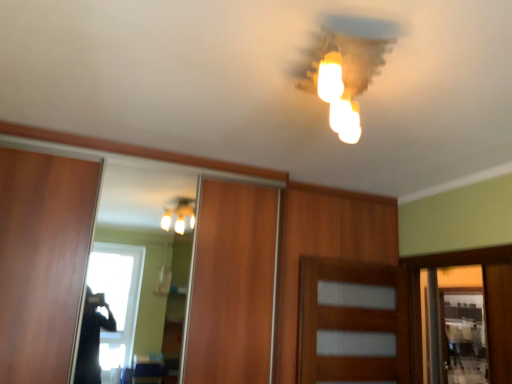
Question: Is wooden door at center in front of matte white light fixture at upper center?

Choices:
 (A) yes
 (B) no

Answer: (B)

Question: Can you confirm if wooden door at center is taller than matte white light fixture at upper center?

Choices:
 (A) yes
 (B) no

Answer: (A)

Question: Can you see wooden door at center touching matte white light fixture at upper center?

Choices:
 (A) no
 (B) yes

Answer: (A)

Question: Is wooden door at center positioned with its back to matte white light fixture at upper center?

Choices:
 (A) yes
 (B) no

Answer: (B)

Question: Does wooden door at center have a smaller size compared to matte white light fixture at upper center?

Choices:
 (A) yes
 (B) no

Answer: (B)

Question: From the image's perspective, is wooden door at center over matte white light fixture at upper center?

Choices:
 (A) no
 (B) yes

Answer: (A)

Question: Does matte white light fixture at upper center appear on the left side of wooden door at center?

Choices:
 (A) no
 (B) yes

Answer: (B)

Question: Does matte white light fixture at upper center have a lesser width compared to wooden door at center?

Choices:
 (A) no
 (B) yes

Answer: (A)

Question: Can you see matte white light fixture at upper center touching wooden door at center?

Choices:
 (A) no
 (B) yes

Answer: (A)

Question: From the image's perspective, is matte white light fixture at upper center over wooden door at center?

Choices:
 (A) no
 (B) yes

Answer: (B)

Question: Considering the relative sizes of matte white light fixture at upper center and wooden door at center in the image provided, is matte white light fixture at upper center taller than wooden door at center?

Choices:
 (A) yes
 (B) no

Answer: (B)

Question: Considering the relative sizes of matte white light fixture at upper center and wooden door at center in the image provided, is matte white light fixture at upper center shorter than wooden door at center?

Choices:
 (A) no
 (B) yes

Answer: (B)

Question: Considering the relative positions of wooden door at center and matte white light fixture at upper center in the image provided, is wooden door at center to the left or to the right of matte white light fixture at upper center?

Choices:
 (A) left
 (B) right

Answer: (B)